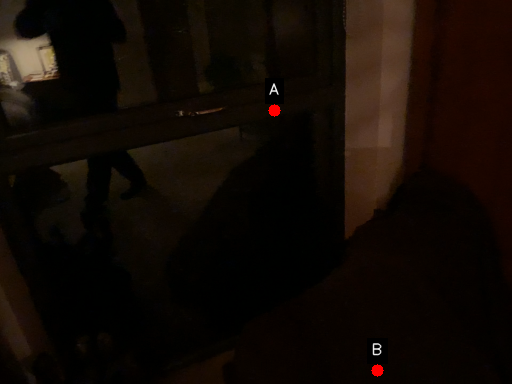
Question: Two points are circled on the image, labeled by A and B beside each circle. Which of the following is the closest to the observer?

Choices:
 (A) A is closer
 (B) B is closer

Answer: (B)